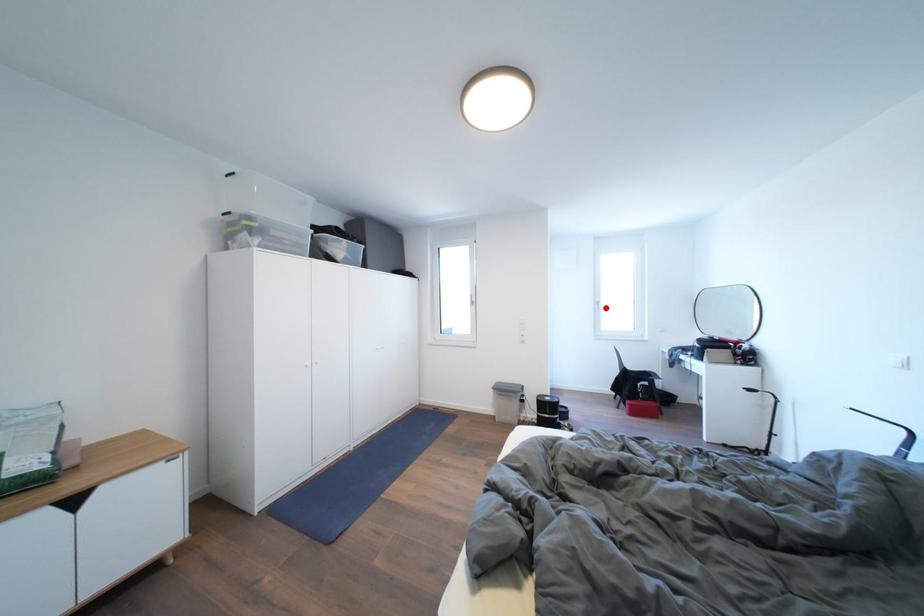
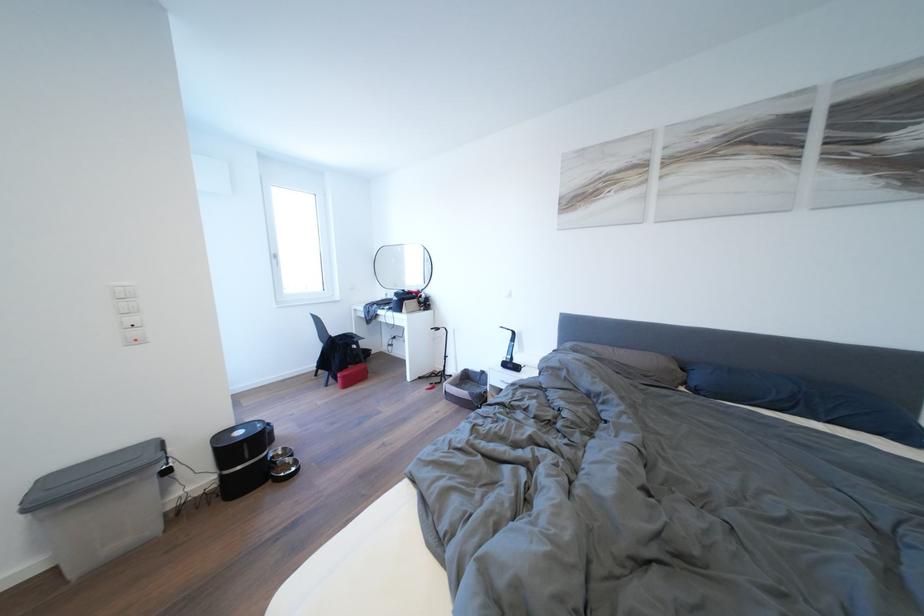
The point at the highlighted location is marked in the first image. Where is the corresponding point in the second image?

(284, 261)